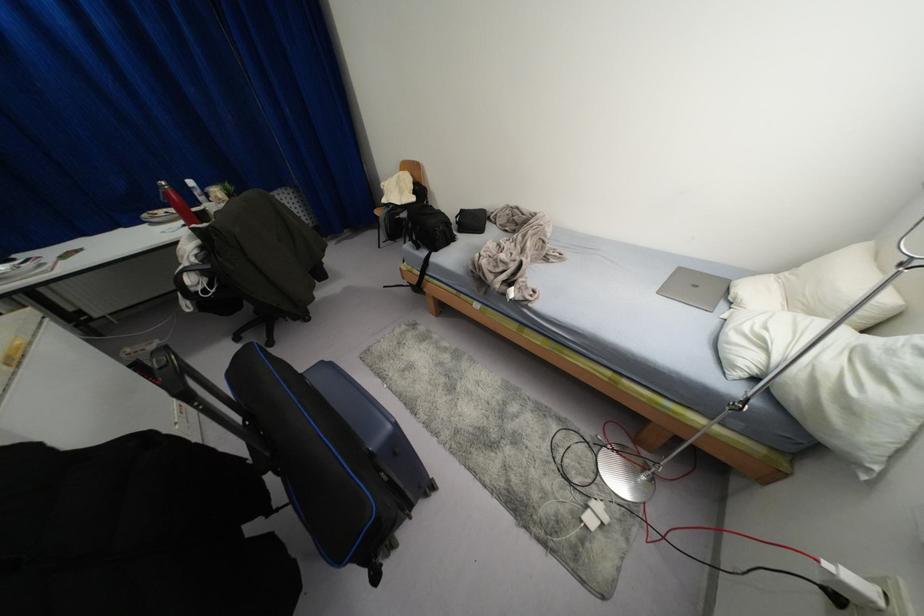
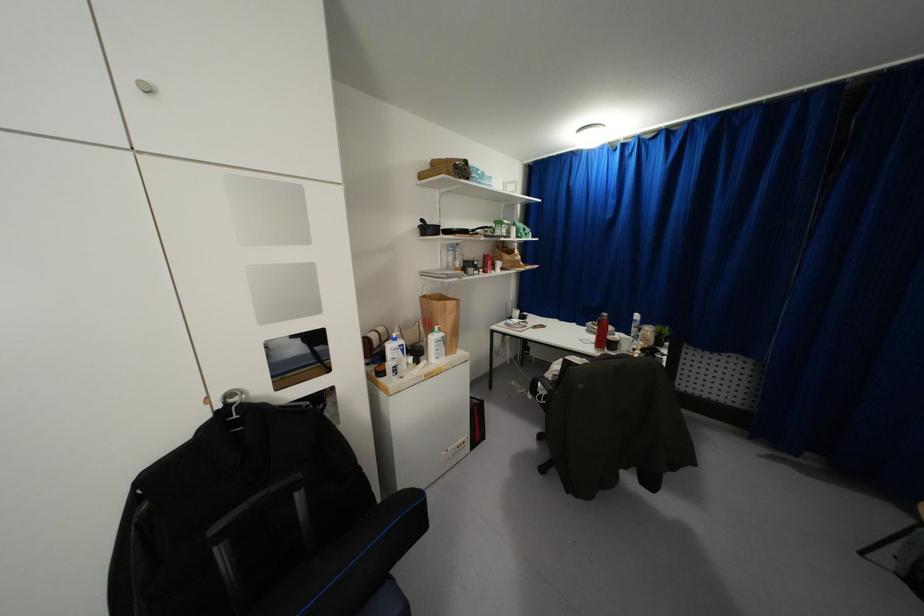
Question: How did the camera likely rotate?

Choices:
 (A) Left
 (B) Right
 (C) Up
 (D) Down

Answer: (A)